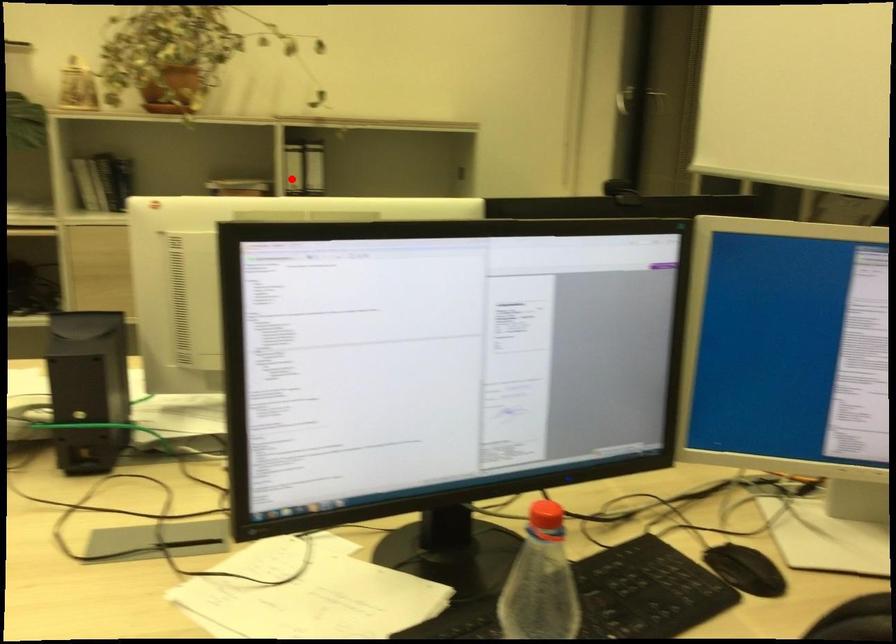
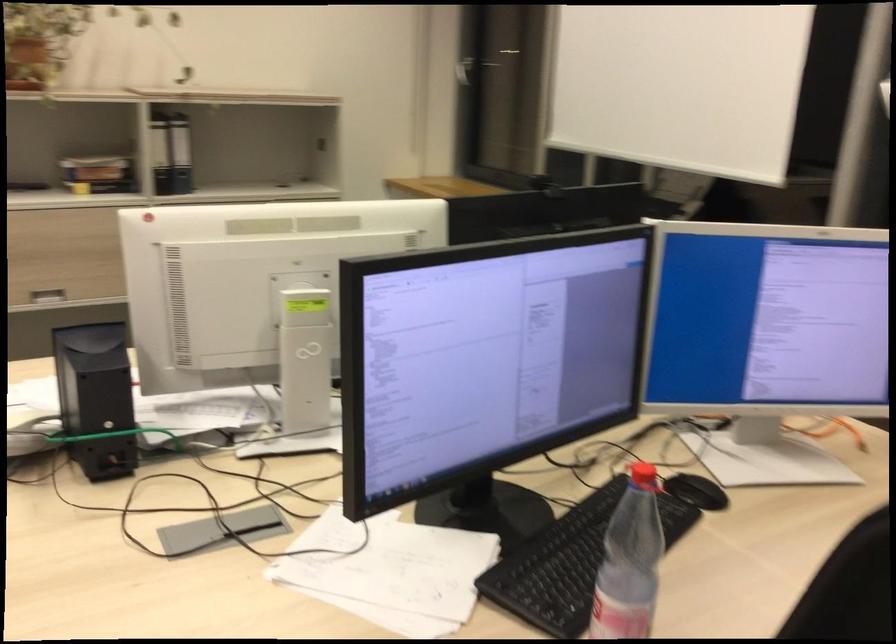
In the second image, find the point that corresponds to the highlighted location in the first image.

(160, 153)